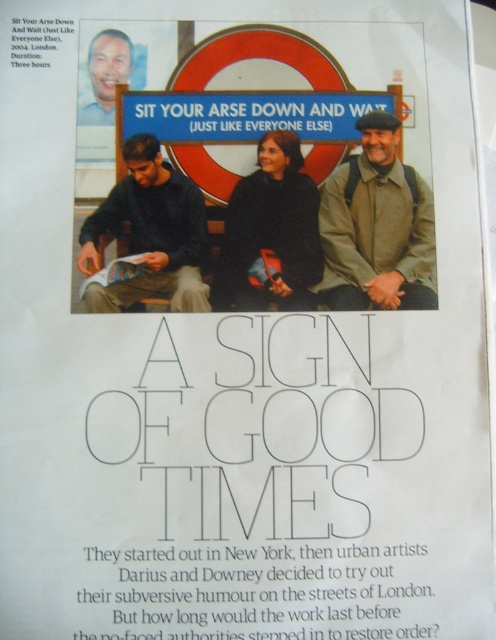
You are a photographer trying to capture a clear shot of the blue plastic sign at upper center and the matte black face at upper left. Which object should you focus on first to ensure both are in focus?

The blue plastic sign at upper center is closer to the viewer than the matte black face at upper left, so focus on the blue plastic sign at upper center first. This way, the matte black face at upper left will naturally come into focus as it is further back.

You are a graphic designer reviewing this magazine layout. You notice the matte black face at upper left and the matte paper magazine at center. Which object appears larger in height?

The matte black face at upper left is taller than the matte paper magazine at center, so it appears larger in height.

You are an urban planner analyzing this image for public signage. The blue plastic sign at upper center and the matte black face at upper left are both in your field of view. Which object is shorter?

The blue plastic sign at upper center is not as tall as matte black face at upper left, so the blue plastic sign at upper center is shorter.